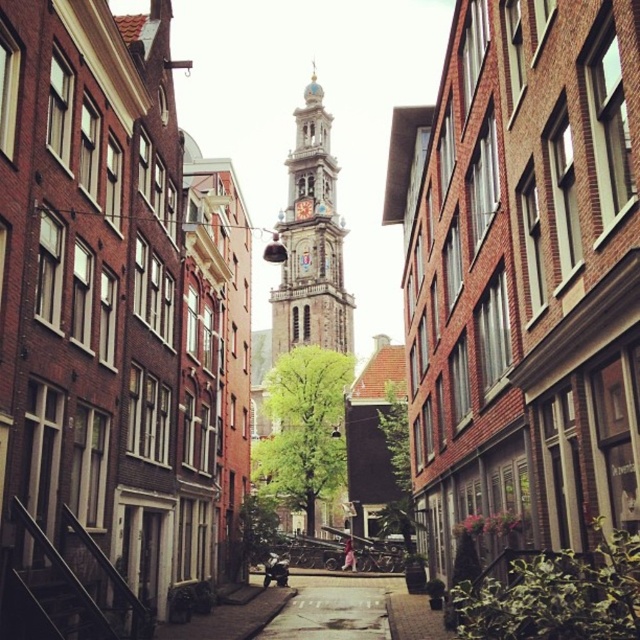
You are standing in the middle of the narrow alleyway in the European city scene. You want to take a photo of the smooth stone clock tower at center. Where should you position yourself to ensure the tower is centered in your camera frame?

To center the smooth stone clock tower at center in your camera frame, position yourself directly in front of it at the point specified by its 2D coordinates, which is at location (310,241).

You are standing at the entrance of the alleyway and want to take a photo of the smooth stone clock tower at center. To ensure the clock tower is centered in your photo, where should you position yourself relative to the point marked at coordinate [310,241]?

To center the smooth stone clock tower at center in your photo, you should position yourself directly facing the point marked at coordinate [310,241], as that is where the tower is located.

You are a tourist standing at the entrance of the alleyway and want to take a photo of the smooth stone clock tower at center and the smooth concrete pavement at center. Which object will appear bigger in your photo?

The smooth stone clock tower at center will appear bigger in the photo because it is larger in size than the smooth concrete pavement at center.